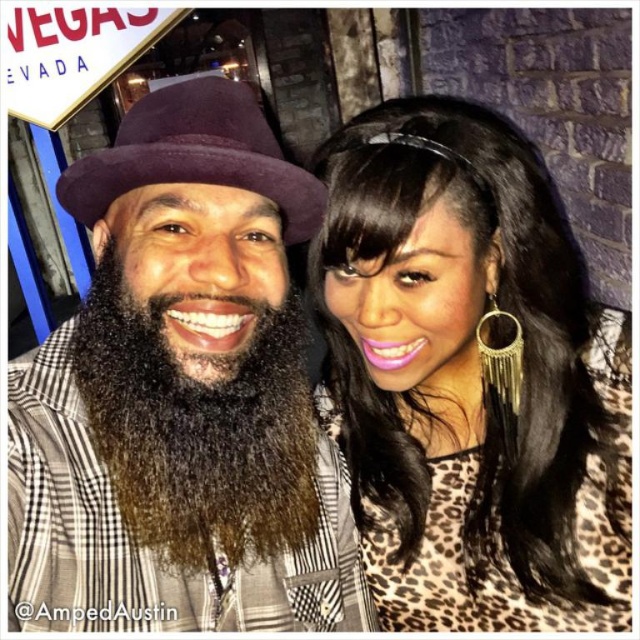
Question: Which point is farther to the camera?

Choices:
 (A) matte purple hat at center
 (B) dark brown fuzzy beard at center

Answer: (B)

Question: Is matte purple hat at center wider than leopard print blouse at center?

Choices:
 (A) yes
 (B) no

Answer: (A)

Question: Does matte purple hat at center have a lesser width compared to leopard print blouse at center?

Choices:
 (A) no
 (B) yes

Answer: (A)

Question: Is matte purple hat at center behind leopard print blouse at center?

Choices:
 (A) yes
 (B) no

Answer: (B)

Question: Which of these objects is positioned closest to the matte purple hat at center?

Choices:
 (A) dark brown fuzzy beard at center
 (B) leopard print blouse at center

Answer: (A)

Question: Among these points, which one is nearest to the camera?

Choices:
 (A) (209, 406)
 (B) (88, 452)
 (C) (346, 445)

Answer: (A)